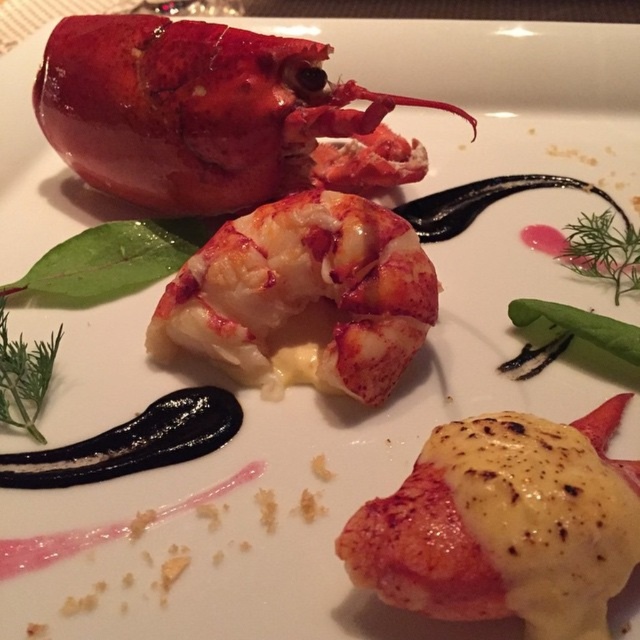
Is shiny red lobster at upper left wider than savory lobster tail at center?

Yes.

The image size is (640, 640). I want to click on shiny red lobster at upper left, so click(195, 109).

The height and width of the screenshot is (640, 640). I want to click on shiny red lobster at upper left, so tap(195, 109).

Between shiny red lobster at upper left and shiny pink lobster at center, which one has more height?

shiny red lobster at upper left

You are a GUI agent. You are given a task and a screenshot of the screen. Output one action in this format:
    pyautogui.click(x=<x>, y=<y>)
    Task: Click on the shiny red lobster at upper left
    
    Given the screenshot: What is the action you would take?
    pyautogui.click(x=195, y=109)

This screenshot has height=640, width=640. I want to click on shiny red lobster at upper left, so click(x=195, y=109).

How far apart are savory lobster tail at center and shiny pink lobster at center?

They are 34.53 centimeters apart.

Is savory lobster tail at center taller than shiny pink lobster at center?

Incorrect, savory lobster tail at center's height is not larger of shiny pink lobster at center's.

Does point (477, 612) come behind point (364, 388)?

No, it is not.

Locate an element on the screen. This screenshot has width=640, height=640. savory lobster tail at center is located at coordinates (506, 524).